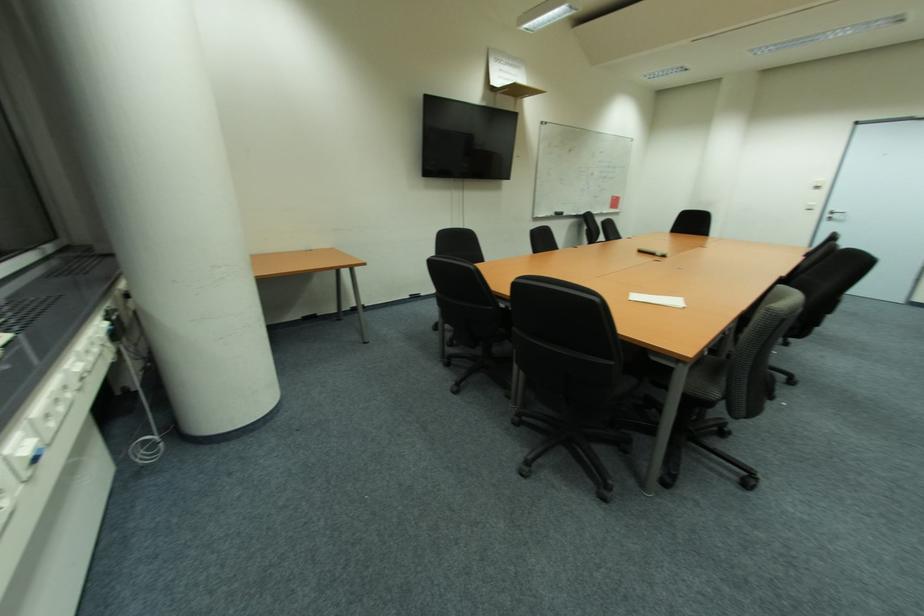
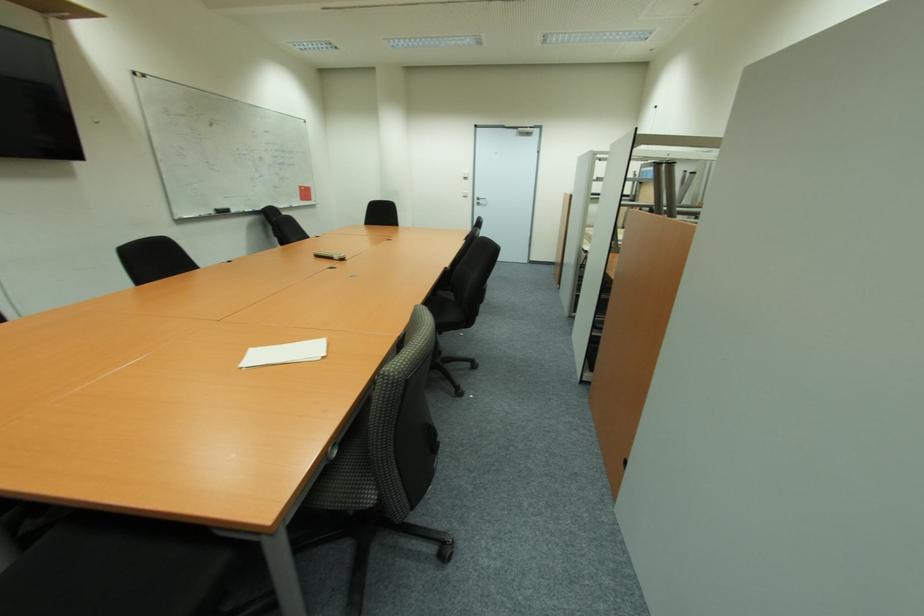
In the second image, find the point that corresponds to point (636, 300) in the first image.

(244, 367)